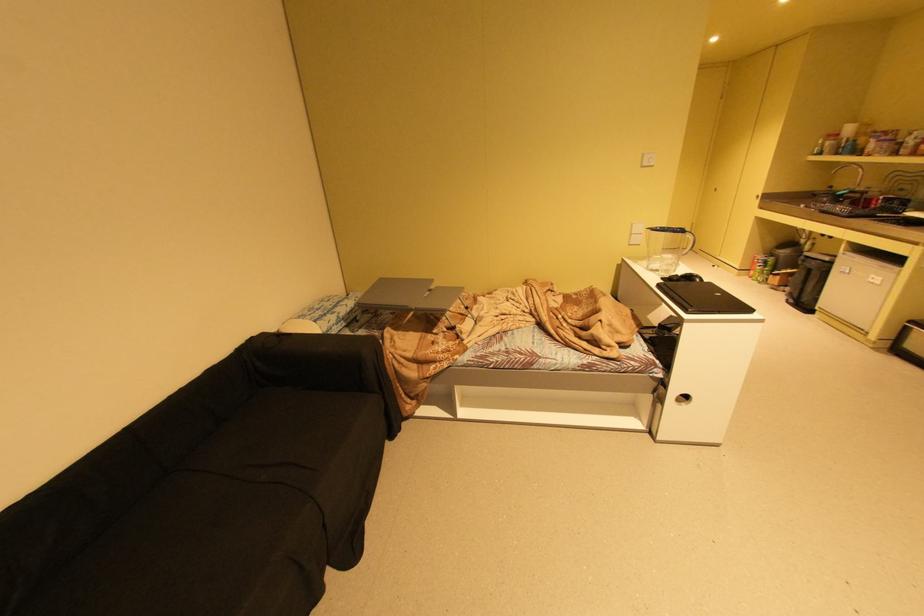
Where would you placing in the grey trash can? Please return your answer as a coordinate pair (x, y).

(808, 281)